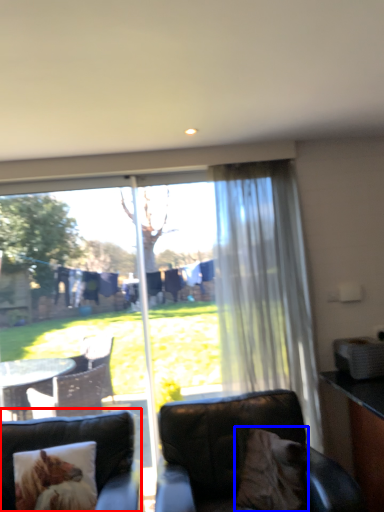
Question: Which of the following is the farthest to the observer, studio couch (highlighted by a red box) or pillow (highlighted by a blue box)?

Choices:
 (A) studio couch
 (B) pillow

Answer: (B)